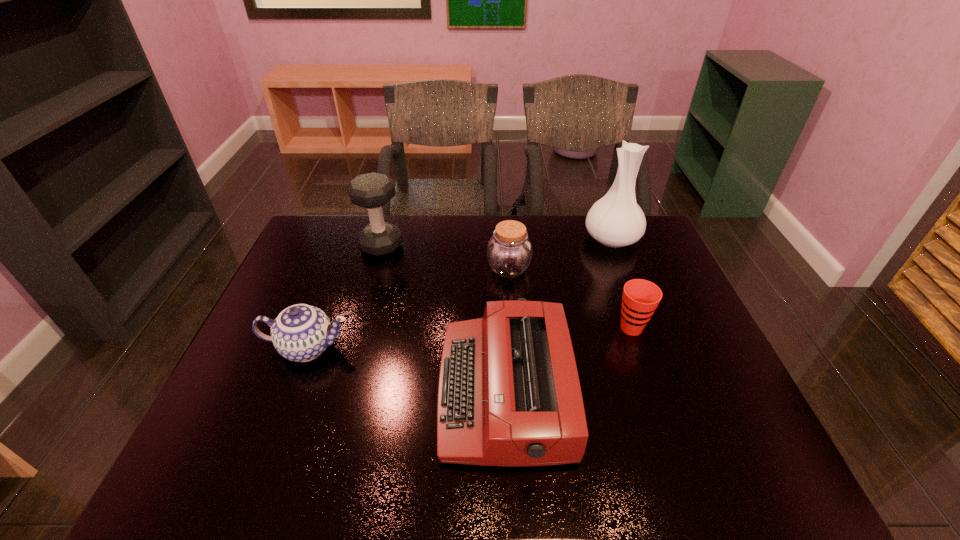
The height and width of the screenshot is (540, 960). What are the coordinates of `vacant area in the image that satisfies the following two spatial constraints: 1. on the front side of the cup; 2. on the typing side of the typewriter` in the screenshot? It's located at tap(654, 392).

Where is `free space that satisfies the following two spatial constraints: 1. on the front side of the cup; 2. on the left side of the dumbbell`? The width and height of the screenshot is (960, 540). free space that satisfies the following two spatial constraints: 1. on the front side of the cup; 2. on the left side of the dumbbell is located at coordinates [x=358, y=328].

At what (x,y) coordinates should I click in order to perform the action: click on free point that satisfies the following two spatial constraints: 1. on the front side of the tallest object; 2. at the spout of the chinaware. Please return your answer as a coordinate pair (x, y). This screenshot has height=540, width=960. Looking at the image, I should click on (654, 348).